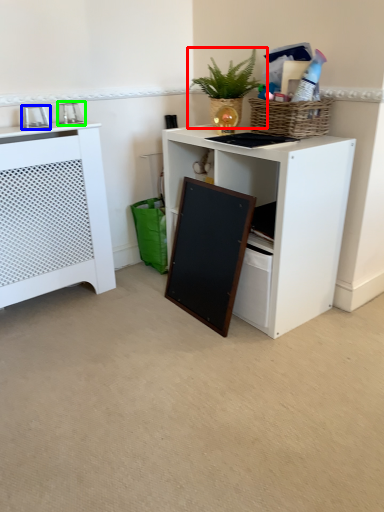
Question: Which is nearer to the houseplant (highlighted by a red box)? appliance (highlighted by a blue box) or appliance (highlighted by a green box).

Choices:
 (A) appliance
 (B) appliance

Answer: (B)